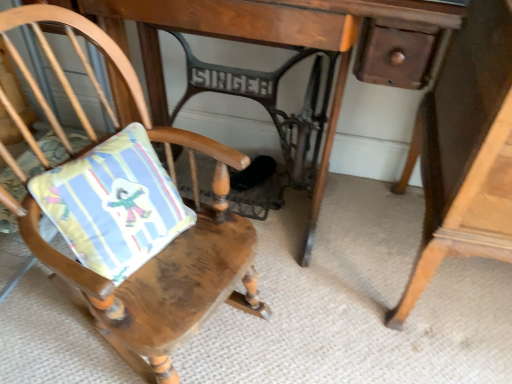
Question: From the image's perspective, does striped fabric cushion at left appear higher than wooden table at center?

Choices:
 (A) no
 (B) yes

Answer: (A)

Question: Considering the relative sizes of striped fabric cushion at left and wooden table at center in the image provided, is striped fabric cushion at left thinner than wooden table at center?

Choices:
 (A) no
 (B) yes

Answer: (B)

Question: Considering the relative sizes of striped fabric cushion at left and wooden table at center in the image provided, is striped fabric cushion at left taller than wooden table at center?

Choices:
 (A) no
 (B) yes

Answer: (A)

Question: Is striped fabric cushion at left at the right side of wooden table at center?

Choices:
 (A) yes
 (B) no

Answer: (B)

Question: Is striped fabric cushion at left not close to wooden table at center?

Choices:
 (A) no
 (B) yes

Answer: (A)

Question: Would you say striped fabric cushion at left is to the left or to the right of wooden cushioned chair at center in the picture?

Choices:
 (A) right
 (B) left

Answer: (B)

Question: Is point (160, 231) positioned closer to the camera than point (154, 326)?

Choices:
 (A) closer
 (B) farther

Answer: (B)

Question: From a real-world perspective, is striped fabric cushion at left above or below wooden cushioned chair at center?

Choices:
 (A) below
 (B) above

Answer: (B)

Question: Is striped fabric cushion at left in front of or behind wooden cushioned chair at center in the image?

Choices:
 (A) behind
 (B) front

Answer: (A)

Question: Is wooden table at center bigger or smaller than wooden cushioned chair at center?

Choices:
 (A) big
 (B) small

Answer: (A)

Question: Looking at their shapes, would you say wooden table at center is wider or thinner than wooden cushioned chair at center?

Choices:
 (A) wide
 (B) thin

Answer: (B)

Question: In terms of height, does wooden table at center look taller or shorter compared to wooden cushioned chair at center?

Choices:
 (A) tall
 (B) short

Answer: (A)

Question: Based on their positions, is wooden table at center located to the left or right of wooden cushioned chair at center?

Choices:
 (A) left
 (B) right

Answer: (B)

Question: Looking at their shapes, would you say wooden cushioned chair at center is wider or thinner than striped fabric cushion at left?

Choices:
 (A) thin
 (B) wide

Answer: (B)

Question: Is point (169, 322) positioned closer to the camera than point (168, 178)?

Choices:
 (A) closer
 (B) farther

Answer: (A)